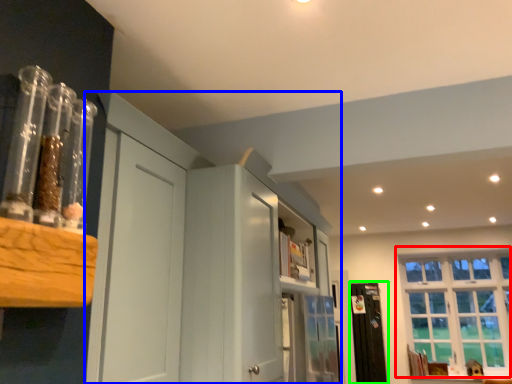
Question: Which object is the farthest from window (highlighted by a red box)? Choose among these: dresser (highlighted by a blue box) or screen door (highlighted by a green box).

Choices:
 (A) dresser
 (B) screen door

Answer: (A)